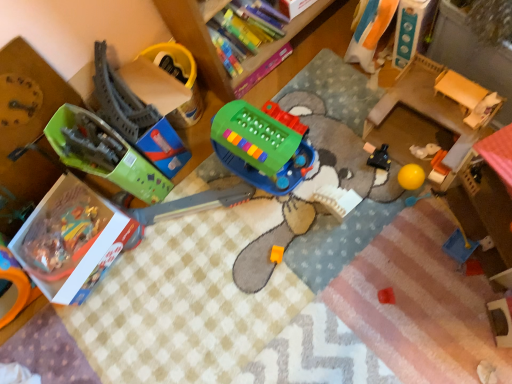
This screenshot has height=384, width=512. I want to click on free space in front of blue plastic dustpan at lower right, which ranks as the 1th toy in right-to-left order, so click(x=476, y=303).